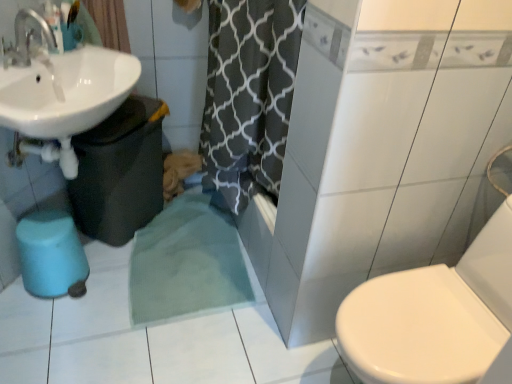
Question: Considering the positions of point (116, 9) and point (29, 263), is point (116, 9) closer or farther from the camera than point (29, 263)?

Choices:
 (A) closer
 (B) farther

Answer: (B)

Question: Considering their positions, is cotton curtain at upper left located in front of or behind blue rubber bidet at lower left?

Choices:
 (A) front
 (B) behind

Answer: (B)

Question: Which object is positioned closest to the white glossy sink at upper left?

Choices:
 (A) cotton curtain at upper left
 (B) blue rubber bidet at lower left

Answer: (A)

Question: Which object is positioned farthest from the cotton curtain at upper left?

Choices:
 (A) blue rubber bidet at lower left
 (B) white glossy sink at upper left

Answer: (A)